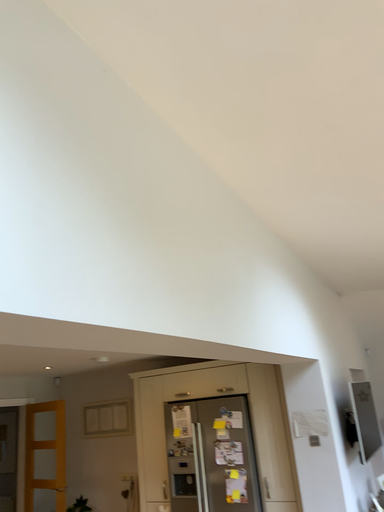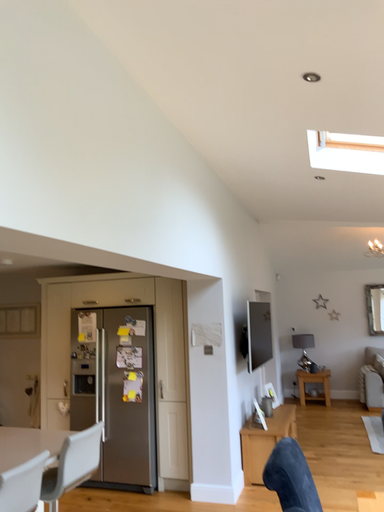
Question: How did the camera likely rotate when shooting the video?

Choices:
 (A) rotated left
 (B) rotated right

Answer: (B)